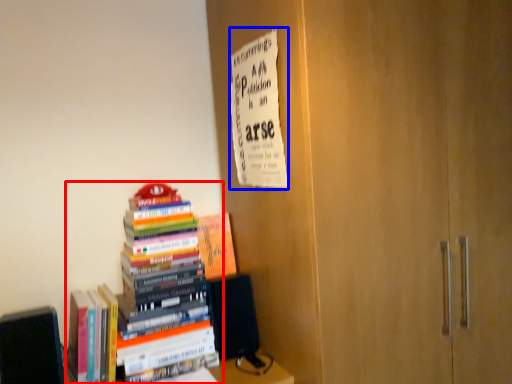
Question: Which point is closer to the camera, book (highlighted by a red box) or paperback book (highlighted by a blue box)?

Choices:
 (A) book
 (B) paperback book

Answer: (B)